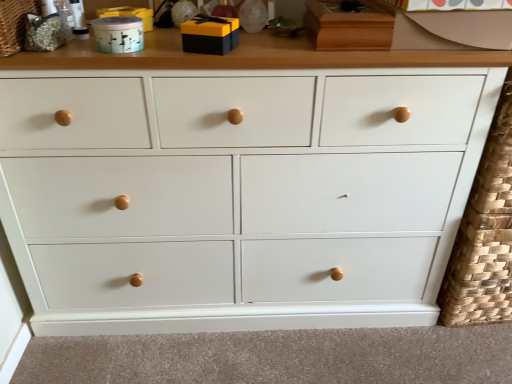
This screenshot has height=384, width=512. Identify the location of spots to the right of matte teal ceramic container at upper left, placed as the second toy when sorted from right to left. (175, 56).